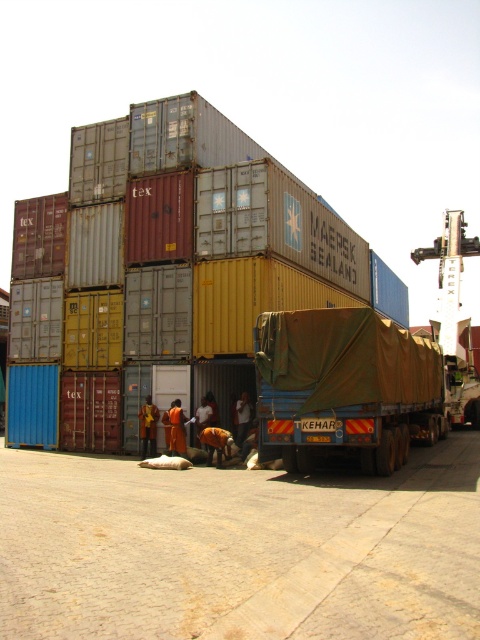
Who is more forward, (81, 348) or (355, 362)?

Point (355, 362)

Is camouflage fabric tarpaulin at center bigger than brown canvas trailer truck at center?

Indeed, camouflage fabric tarpaulin at center has a larger size compared to brown canvas trailer truck at center.

Find the location of a particular element. camouflage fabric tarpaulin at center is located at coordinates (178, 253).